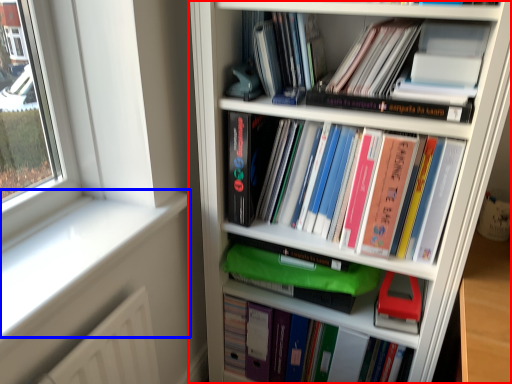
Question: Among these objects, which one is farthest to the camera, bookcase (highlighted by a red box) or window sill (highlighted by a blue box)?

Choices:
 (A) bookcase
 (B) window sill

Answer: (B)